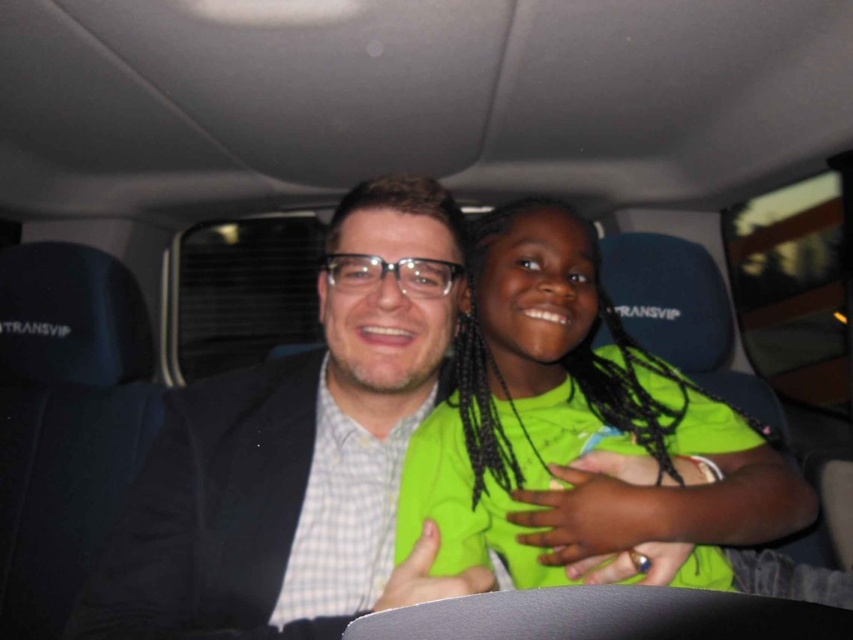
Who is positioned more to the right, matte black suit at center or neon green shirt at center?

Positioned to the right is neon green shirt at center.

Does point (218, 570) come closer to viewer compared to point (593, 276)?

Yes, it is in front of point (593, 276).

You are a GUI agent. You are given a task and a screenshot of the screen. Output one action in this format:
    pyautogui.click(x=<x>, y=<y>)
    Task: Click on the matte black suit at center
    This screenshot has width=853, height=640.
    Given the screenshot: What is the action you would take?
    pyautogui.click(x=283, y=452)